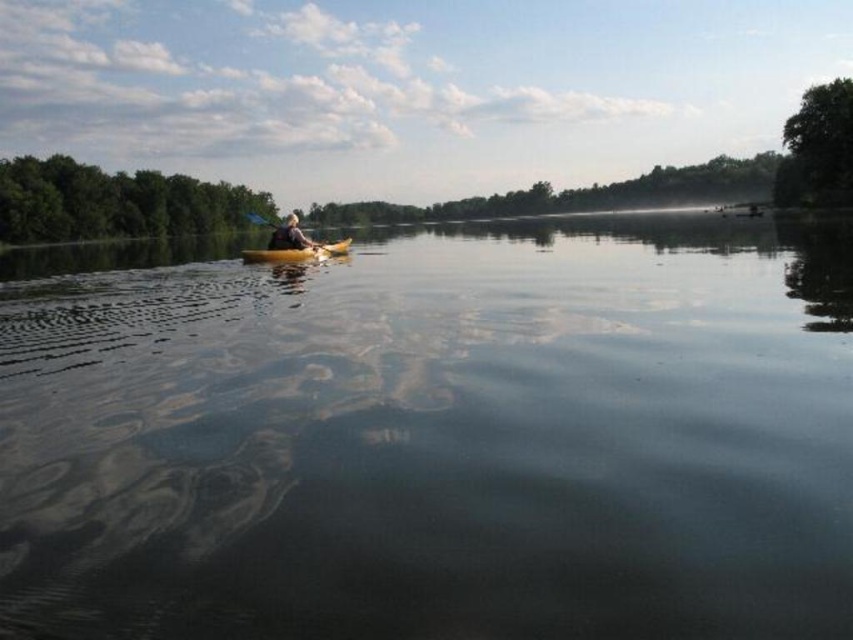
Is point (233, 541) closer to camera compared to point (280, 244)?

Yes, point (233, 541) is closer to viewer.

Between clear water at center and yellow plastic kayak at center, which one appears on the left side from the viewer's perspective?

From the viewer's perspective, yellow plastic kayak at center appears more on the left side.

Between point (761, 573) and point (293, 220), which one is positioned in front?

Point (761, 573) is in front.

At what (x,y) coordinates should I click in order to perform the action: click on clear water at center. Please return your answer as a coordinate pair (x, y). The width and height of the screenshot is (853, 640). Looking at the image, I should click on 433,435.

Which is more to the left, clear water at center or yellow matte canoe at center?

From the viewer's perspective, yellow matte canoe at center appears more on the left side.

Is point (637, 216) behind point (318, 253)?

Yes.

Find the location of a particular element. The width and height of the screenshot is (853, 640). clear water at center is located at coordinates (433, 435).

Who is taller, yellow matte canoe at center or yellow plastic kayak at center?

Standing taller between the two is yellow matte canoe at center.

Which is behind, point (350, 237) or point (286, 234)?

The point (350, 237) is behind.

Between point (335, 243) and point (306, 244), which one is positioned in front?

Point (306, 244) is more forward.

At what (x,y) coordinates should I click in order to perform the action: click on yellow matte canoe at center. Please return your answer as a coordinate pair (x, y). Looking at the image, I should click on [x=297, y=252].